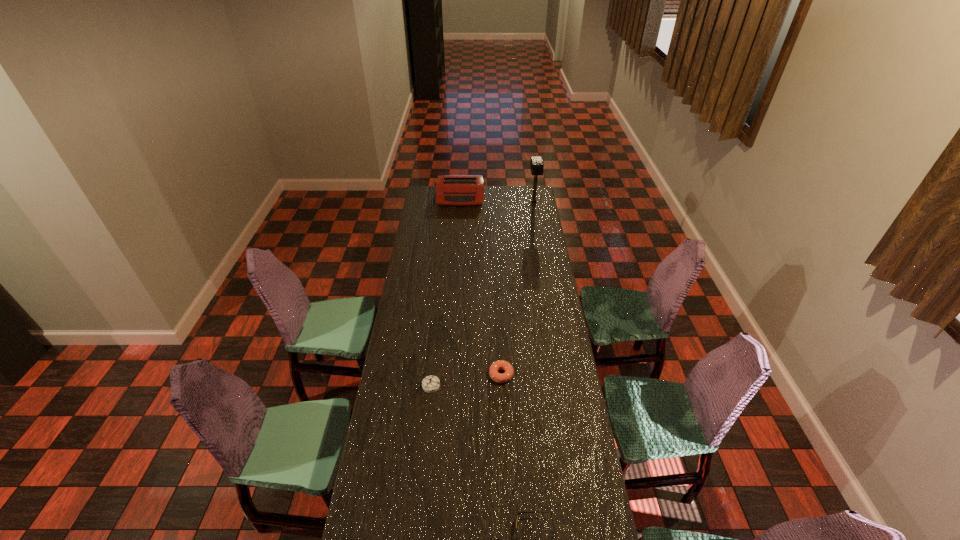
The height and width of the screenshot is (540, 960). Find the location of `typewriter located at the far edge`. typewriter located at the far edge is located at coordinates (457, 190).

I want to click on typewriter positioned at the left edge, so click(x=457, y=190).

Find the location of `compass situated at the left edge`. compass situated at the left edge is located at coordinates click(x=430, y=384).

Locate an element on the screen. This screenshot has width=960, height=540. object that is at the right edge is located at coordinates [536, 164].

Locate an element on the screen. The width and height of the screenshot is (960, 540). object that is at the far left corner is located at coordinates (457, 190).

The image size is (960, 540). Find the location of `object at the far right corner`. object at the far right corner is located at coordinates (536, 164).

At what (x,y) coordinates should I click in order to perform the action: click on vacant space at the left edge of the desktop. Please return your answer as a coordinate pair (x, y). Looking at the image, I should click on (431, 205).

The width and height of the screenshot is (960, 540). In order to click on free point at the right edge in this screenshot , I will do pyautogui.click(x=543, y=225).

Find the location of a particular element. free space between the second shortest object and the rightmost object is located at coordinates (517, 288).

The height and width of the screenshot is (540, 960). I want to click on unoccupied position between the compass and the fourth shortest object, so click(445, 291).